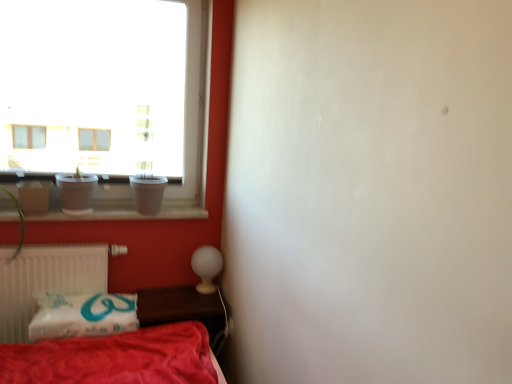
What is the approximate height of white plastic radiator at lower left?

The height of white plastic radiator at lower left is 19.47 inches.

This screenshot has height=384, width=512. What do you see at coordinates (180, 307) in the screenshot? I see `wooden table at lower center` at bounding box center [180, 307].

This screenshot has height=384, width=512. What are the coordinates of `green matte plant at left` in the screenshot? It's located at (20, 222).

Measure the distance between white glossy table lamp at lower center and camera.

The depth of white glossy table lamp at lower center is 2.38 meters.

The image size is (512, 384). Describe the element at coordinates (76, 192) in the screenshot. I see `transparent glass vase at left` at that location.

Where is `red cotton blanket at lower left`? This screenshot has height=384, width=512. red cotton blanket at lower left is located at coordinates point(83,315).

Where is `white plastic radiator at lower left`? The height and width of the screenshot is (384, 512). white plastic radiator at lower left is located at coordinates (46, 281).

Is white glossy table lamp at lower center facing away from green matte plant at left?

No.

Is white glossy table lamp at lower center placed right next to green matte plant at left?

There is a gap between white glossy table lamp at lower center and green matte plant at left.

Which object is wider, white glossy table lamp at lower center or green matte plant at left?

green matte plant at left.

Is white glossy table lamp at lower center shorter than green matte plant at left?

Yes, white glossy table lamp at lower center is shorter than green matte plant at left.

From the image's perspective, is transparent glass vase at left under green matte plant at left?

Incorrect, from the image's perspective, transparent glass vase at left is higher than green matte plant at left.

Based on their sizes in the image, would you say transparent glass vase at left is bigger or smaller than green matte plant at left?

Considering their sizes, transparent glass vase at left takes up less space than green matte plant at left.

Which point is more distant from viewer, (67, 210) or (22, 241)?

The point (67, 210) is more distant.

Is transparent glass vase at left aimed at green matte plant at left?

No, transparent glass vase at left is not oriented towards green matte plant at left.

Is white glossy table lamp at lower center outside of wooden table at lower center?

Absolutely, white glossy table lamp at lower center is external to wooden table at lower center.

Visually, is white glossy table lamp at lower center positioned to the left or to the right of wooden table at lower center?

In the image, white glossy table lamp at lower center appears on the right side of wooden table at lower center.

The image size is (512, 384). In the image, there is a white glossy table lamp at lower center. In order to click on table below it (from the image's perspective) in this screenshot , I will do `click(180, 307)`.

From their relative heights in the image, would you say white glossy table lamp at lower center is taller or shorter than wooden table at lower center?

white glossy table lamp at lower center is taller than wooden table at lower center.

Considering the points (71, 264) and (200, 263), which point is in front, point (71, 264) or point (200, 263)?

Point (71, 264)

Is white plastic radiator at lower left oriented towards white glossy table lamp at lower center?

No, white plastic radiator at lower left is not facing towards white glossy table lamp at lower center.

Is white plastic radiator at lower left to the right of white glossy table lamp at lower center from the viewer's perspective?

No, white plastic radiator at lower left is not to the right of white glossy table lamp at lower center.

Considering the sizes of white plastic radiator at lower left and white glossy table lamp at lower center in the image, is white plastic radiator at lower left taller or shorter than white glossy table lamp at lower center?

Clearly, white plastic radiator at lower left is taller compared to white glossy table lamp at lower center.

In the scene shown: From the image's perspective, is wooden table at lower center over green matte plant at left?

Incorrect, from the image's perspective, wooden table at lower center is lower than green matte plant at left.

Can you confirm if wooden table at lower center is shorter than green matte plant at left?

Yes.

How much distance is there between wooden table at lower center and green matte plant at left?

wooden table at lower center is 33.02 inches away from green matte plant at left.

What are the coordinates of `table below the green matte plant at left (from the image's perspective)` in the screenshot? It's located at (180, 307).

From the image's perspective, does white glossy table lamp at lower center appear higher than red cotton blanket at lower left?

Indeed, from the image's perspective, white glossy table lamp at lower center is shown above red cotton blanket at lower left.

Which is more to the right, white glossy table lamp at lower center or red cotton blanket at lower left?

white glossy table lamp at lower center is more to the right.

Is white glossy table lamp at lower center thinner than red cotton blanket at lower left?

Yes, white glossy table lamp at lower center is thinner than red cotton blanket at lower left.

From a real-world perspective, is white glossy table lamp at lower center physically located above or below red cotton blanket at lower left?

white glossy table lamp at lower center is situated higher than red cotton blanket at lower left in the real world.

Is green matte plant at left completely or partially inside white plastic radiator at lower left?

That's incorrect, green matte plant at left is not inside white plastic radiator at lower left.

From a real-world perspective, relative to green matte plant at left, is white plastic radiator at lower left vertically above or below?

Clearly, from a real-world perspective, white plastic radiator at lower left is below green matte plant at left.

Is white plastic radiator at lower left at the left side of green matte plant at left?

In fact, white plastic radiator at lower left is to the right of green matte plant at left.

Where is `plant above the white plastic radiator at lower left (from the image's perspective)`? plant above the white plastic radiator at lower left (from the image's perspective) is located at coordinates (20, 222).

You are a GUI agent. You are given a task and a screenshot of the screen. Output one action in this format:
    pyautogui.click(x=<x>, y=<y>)
    Task: Click on the plant above the white glossy table lamp at lower center (from a real-world perspective)
    Image resolution: width=512 pixels, height=384 pixels.
    Given the screenshot: What is the action you would take?
    pyautogui.click(x=20, y=222)

Identify the location of plant in front of the transparent glass vase at left. (20, 222).

Which object lies nearer to the anchor point green matte plant at left, transparent glass vase at left or transparent glass window at upper left?

transparent glass vase at left.

Looking at the image, which one is located further to wooden table at lower center, red cotton blanket at lower left or green matte plant at left?

Among the two, green matte plant at left is located further to wooden table at lower center.

Consider the image. Looking at the image, which one is located closer to white glossy table lamp at lower center, transparent glass vase at left or green matte plant at left?

transparent glass vase at left.

Looking at the image, which one is located closer to green matte plant at left, white plastic radiator at lower left or transparent glass vase at left?

white plastic radiator at lower left lies closer to green matte plant at left than the other object.

Looking at the image, which one is located further to transparent glass window at upper left, red cotton blanket at lower left or white plastic radiator at lower left?

red cotton blanket at lower left lies further to transparent glass window at upper left than the other object.

Based on their spatial positions, is wooden table at lower center or transparent glass vase at left closer to red cotton blanket at lower left?

wooden table at lower center is positioned closer to the anchor red cotton blanket at lower left.

Which object lies nearer to the anchor point transparent glass window at upper left, green matte plant at left or white glossy table lamp at lower center?

green matte plant at left is positioned closer to the anchor transparent glass window at upper left.

Which object lies further to the anchor point white plastic radiator at lower left, transparent glass vase at left or transparent glass window at upper left?

transparent glass window at upper left is further to white plastic radiator at lower left.

You are a GUI agent. You are given a task and a screenshot of the screen. Output one action in this format:
    pyautogui.click(x=<x>, y=<y>)
    Task: Click on the glass vase situated between green matte plant at left and white glossy table lamp at lower center from left to right
    The height and width of the screenshot is (384, 512).
    Given the screenshot: What is the action you would take?
    [x=76, y=192]

Locate an element on the screen. plant that lies between transparent glass window at upper left and white plastic radiator at lower left from top to bottom is located at coordinates (20, 222).

You are a GUI agent. You are given a task and a screenshot of the screen. Output one action in this format:
    pyautogui.click(x=<x>, y=<y>)
    Task: Click on the table lamp between transparent glass window at upper left and red cotton blanket at lower left from top to bottom
    
    Given the screenshot: What is the action you would take?
    pyautogui.click(x=206, y=267)

At what (x,y) coordinates should I click in order to perform the action: click on plant between transparent glass vase at left and red cotton blanket at lower left from top to bottom. Please return your answer as a coordinate pair (x, y). The image size is (512, 384). Looking at the image, I should click on (20, 222).